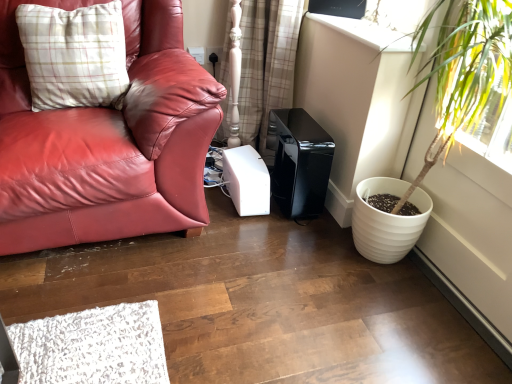
Question: In terms of size, does plaid fabric pillow at upper left appear bigger or smaller than transparent plastic window screen at upper center?

Choices:
 (A) big
 (B) small

Answer: (A)

Question: Is plaid fabric pillow at upper left inside or outside of transparent plastic window screen at upper center?

Choices:
 (A) outside
 (B) inside

Answer: (A)

Question: Based on their relative distances, which object is farther from the white glossy window sill at upper right?

Choices:
 (A) plaid fabric curtain at center
 (B) white textured pot at right
 (C) plaid fabric pillow at upper left
 (D) transparent plastic window screen at upper center

Answer: (C)

Question: Estimate the real-world distances between objects in this image. Which object is closer to the plaid fabric pillow at upper left?

Choices:
 (A) plaid fabric curtain at center
 (B) white textured pot at right
 (C) white glossy window sill at upper right
 (D) transparent plastic window screen at upper center

Answer: (A)